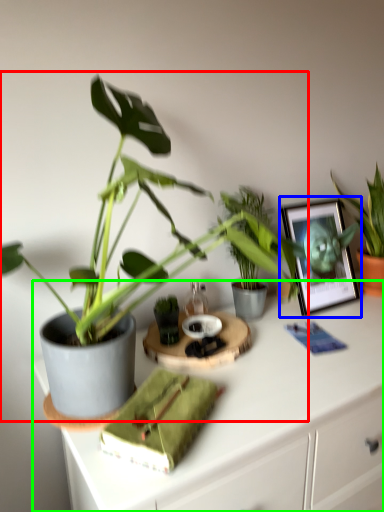
Question: Which is nearer to the houseplant (highlighted by a red box)? picture frame (highlighted by a blue box) or desk (highlighted by a green box).

Choices:
 (A) picture frame
 (B) desk

Answer: (B)